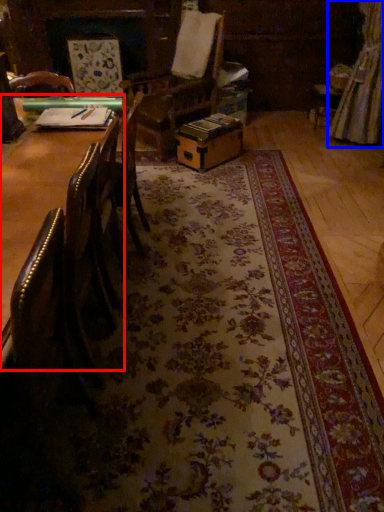
Question: Among these objects, which one is farthest to the camera, table (highlighted by a red box) or curtain (highlighted by a blue box)?

Choices:
 (A) table
 (B) curtain

Answer: (B)